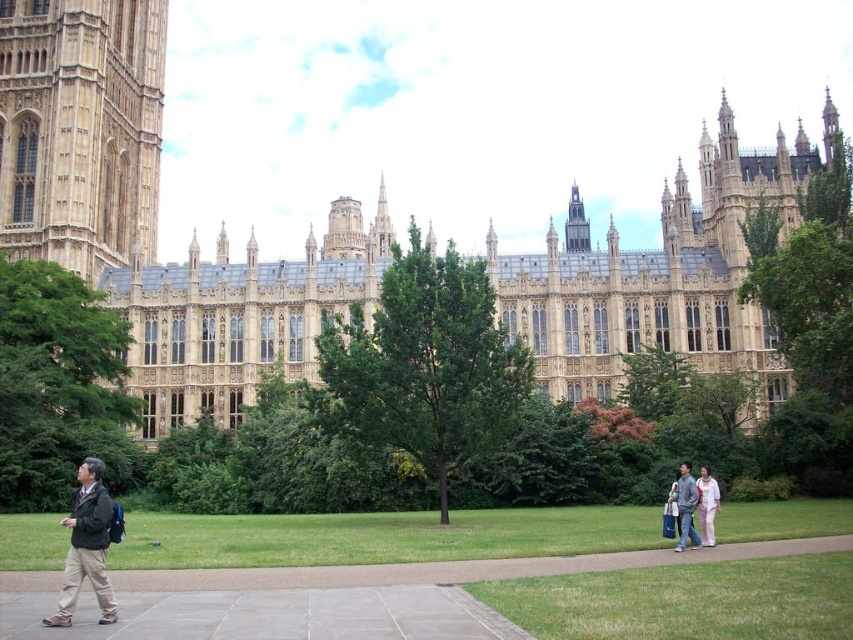
You are standing at the center of the image looking towards the grand historic building. Where would you need to move to see the dark green jacket at lower left?

You would need to move to the lower left direction to see the dark green jacket at lower left since its 2D location is at point [86,547], which places it in the lower left quadrant of the image.

You are standing in front of the historic building and notice two people wearing distinctive clothing. One is wearing a dark green jacket at lower left, and the other has light pink fabric pants at lower right. Which person is standing nearer to you?

The dark green jacket at lower left is closer to the viewer than light pink fabric pants at lower right, so the person wearing the dark green jacket at lower left is nearer to you.

You are a tourist visiting the historic building and you see a gray cotton jacket at lower right and light pink fabric pants at lower right. Which clothing item is taller?

The gray cotton jacket at lower right is much taller than the light pink fabric pants at lower right.